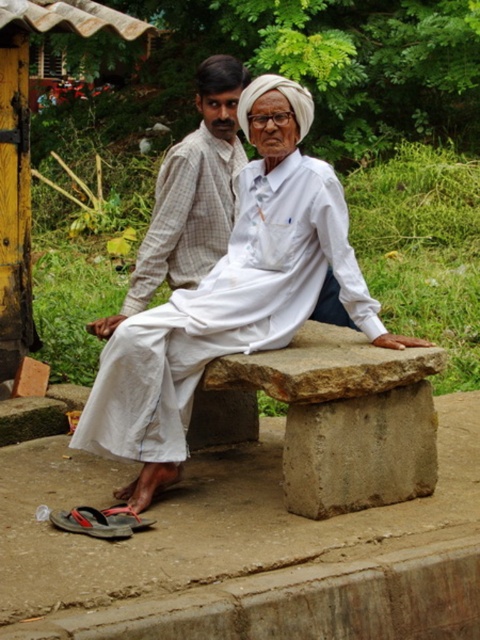
Based on the photo, which is above, white cotton cloth at center or light brown checkered shirt at center?

light brown checkered shirt at center

Who is positioned more to the right, white cotton cloth at center or light brown checkered shirt at center?

white cotton cloth at center

Where is `white cotton cloth at center`? The width and height of the screenshot is (480, 640). white cotton cloth at center is located at coordinates (232, 296).